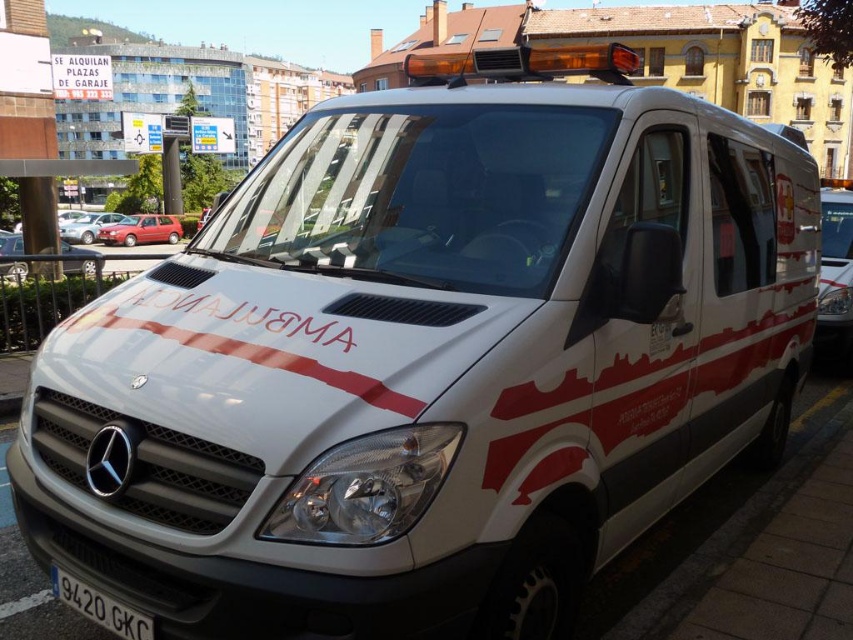
Question: Which object is the farthest from the metallic red hatchback at center-left?

Choices:
 (A) metallic silver sedan at center
 (B) white plastic license plate at lower center

Answer: (B)

Question: Does metallic red hatchback at center-left appear on the right side of matte red car at left?

Choices:
 (A) no
 (B) yes

Answer: (B)

Question: Where is white plastic license plate at lower center located in relation to metallic silver sedan at center in the image?

Choices:
 (A) above
 (B) below

Answer: (B)

Question: Which point is closer to the camera taking this photo?

Choices:
 (A) (128, 236)
 (B) (80, 237)
 (C) (16, 252)
 (D) (67, 600)

Answer: (D)

Question: Which is nearer to the metallic silver sedan at center?

Choices:
 (A) white plastic license plate at lower center
 (B) metallic red hatchback at center-left

Answer: (B)

Question: Can you confirm if white plastic license plate at lower center is thinner than metallic red hatchback at center-left?

Choices:
 (A) yes
 (B) no

Answer: (A)